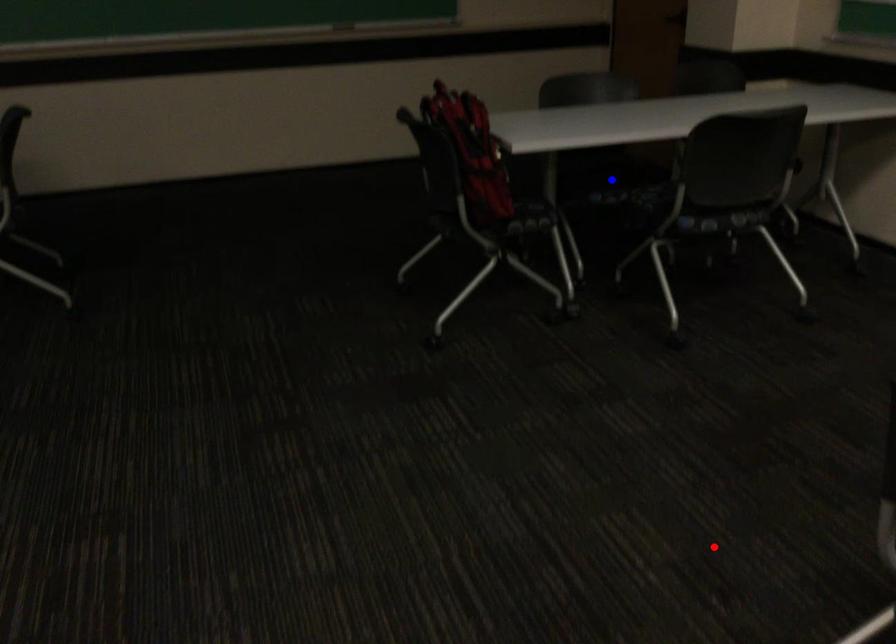
Question: Two points are marked on the image. Which point is closer to the camera?

Choices:
 (A) Blue point is closer.
 (B) Red point is closer.

Answer: (B)